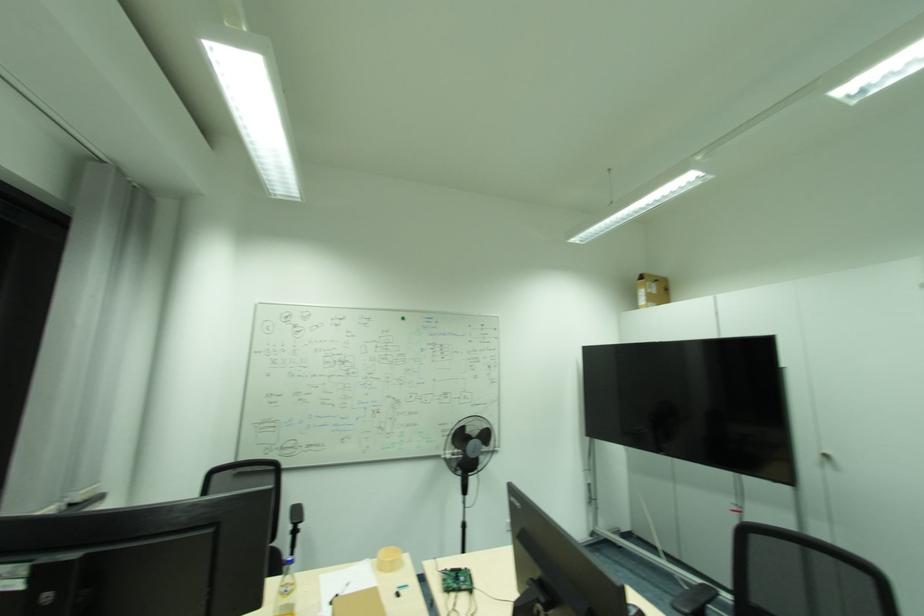
Find where to lift the brown paper cup. Please return your answer as a coordinate pair (x, y).

(388, 559)